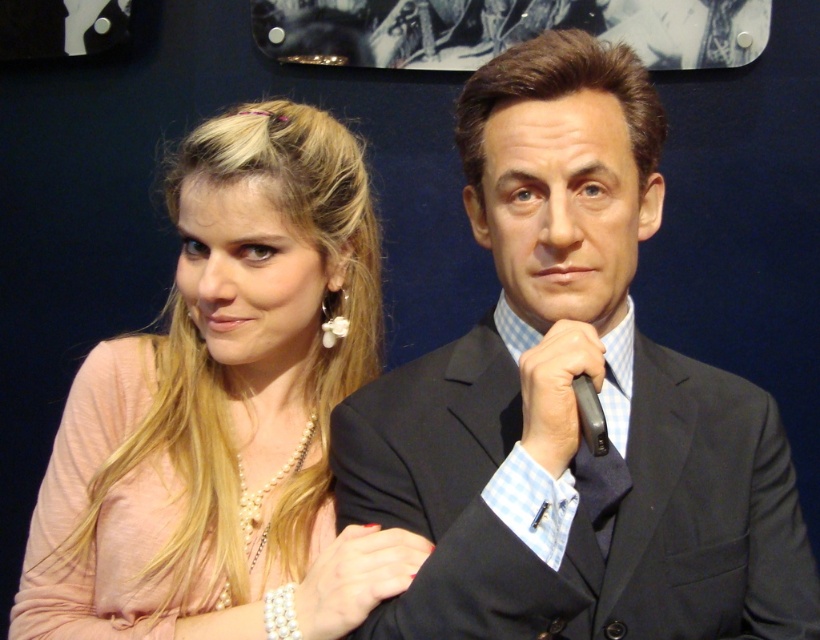
Question: Does smooth black suit at center appear over pearl necklace at center?

Choices:
 (A) no
 (B) yes

Answer: (B)

Question: Among these objects, which one is farthest from the camera?

Choices:
 (A) dark blue textured tie at center
 (B) smooth black suit at center

Answer: (A)

Question: Estimate the real-world distances between objects in this image. Which object is closer to the pearl necklace at center?

Choices:
 (A) smooth black suit at center
 (B) dark blue textured tie at center

Answer: (A)

Question: Does pearl necklace at center appear under dark blue textured tie at center?

Choices:
 (A) no
 (B) yes

Answer: (B)

Question: Does smooth black suit at center have a smaller size compared to pearl necklace at center?

Choices:
 (A) no
 (B) yes

Answer: (B)

Question: Which of the following is the closest to the observer?

Choices:
 (A) (541, 531)
 (B) (444, 624)

Answer: (A)